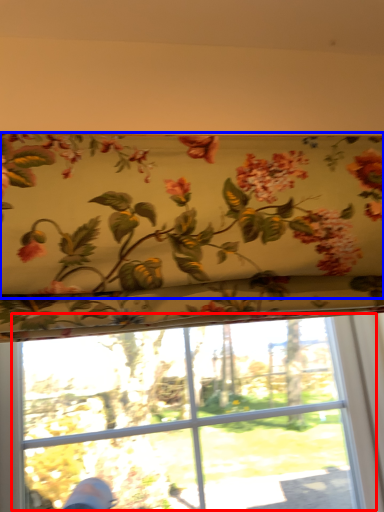
Question: Which object appears closest to the camera in this image, bay window (highlighted by a red box) or floral arrangement (highlighted by a blue box)?

Choices:
 (A) bay window
 (B) floral arrangement

Answer: (B)